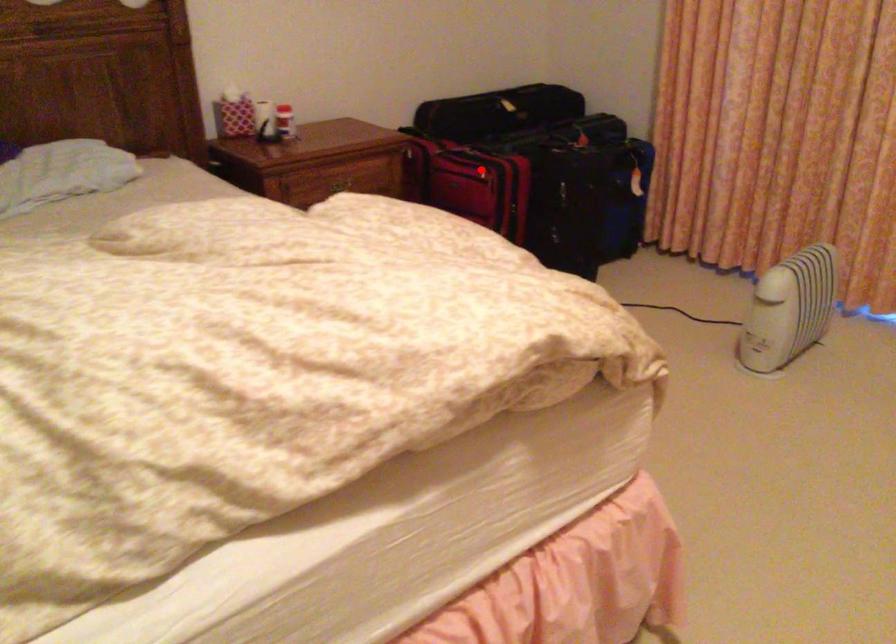
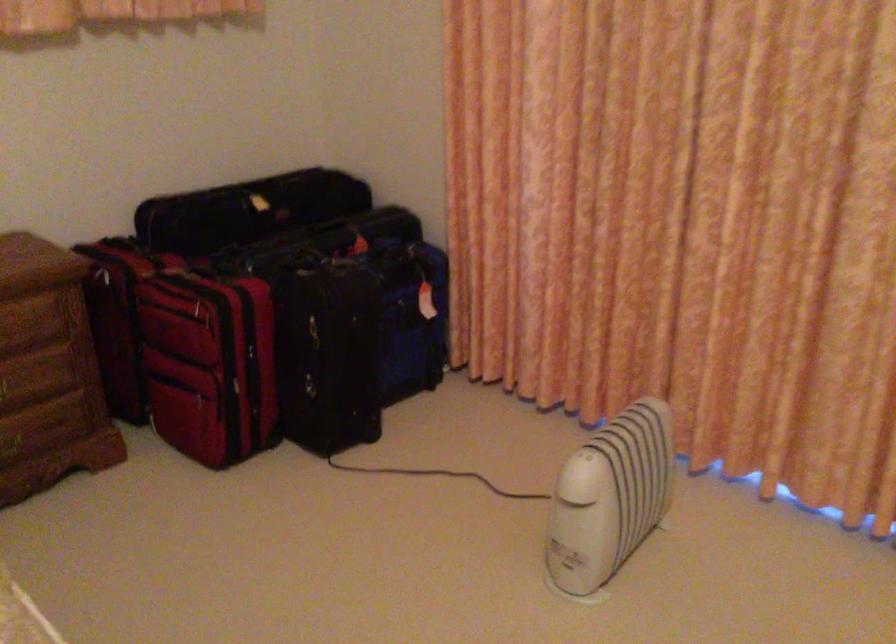
Locate, in the second image, the point that corresponds to the highlighted location in the first image.

(202, 305)